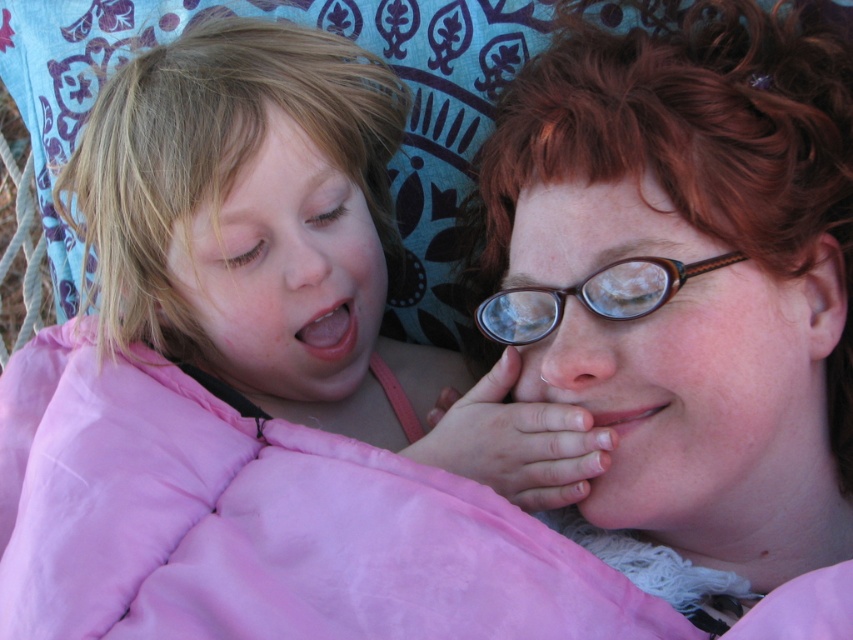
Question: Which point appears closest to the camera in this image?

Choices:
 (A) pyautogui.click(x=285, y=205)
 (B) pyautogui.click(x=561, y=403)
 (C) pyautogui.click(x=635, y=314)
 (D) pyautogui.click(x=628, y=333)

Answer: (C)

Question: Which point is closer to the camera?

Choices:
 (A) brown/leather glasses at center
 (B) pink fabric at left

Answer: (A)

Question: Is matte pink jacket at center to the right of brown/leather glasses at center from the viewer's perspective?

Choices:
 (A) no
 (B) yes

Answer: (B)

Question: Considering the real-world distances, which object is farthest from the pink fabric at left?

Choices:
 (A) brown/leather glasses at center
 (B) matte pink jacket at center

Answer: (B)

Question: Is pink fabric at left to the left of brown/leather glasses at center from the viewer's perspective?

Choices:
 (A) yes
 (B) no

Answer: (A)

Question: Does matte pink jacket at center lie in front of matte brown glasses at center?

Choices:
 (A) yes
 (B) no

Answer: (A)